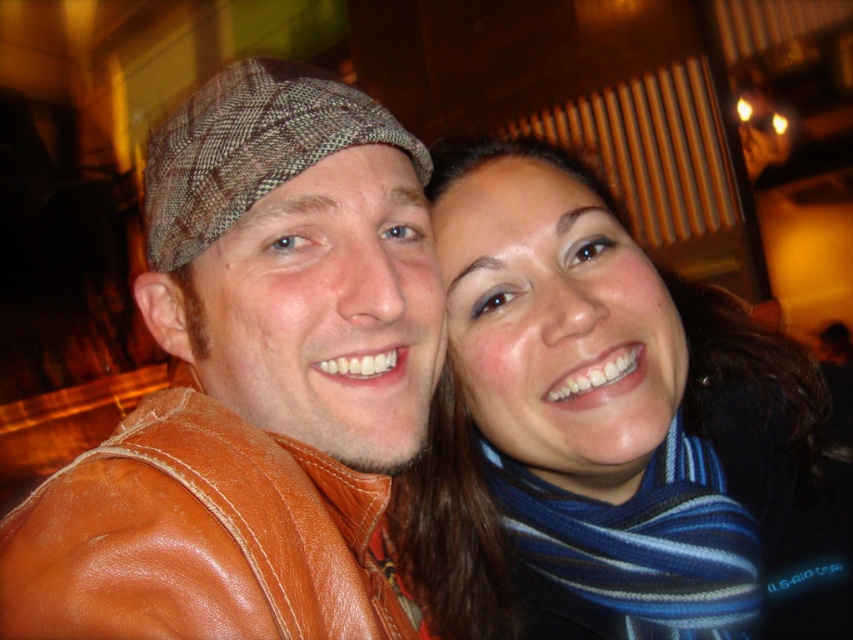
Which of these two, brown leather jacket at left or striped scarf at center, stands shorter?

Standing shorter between the two is brown leather jacket at left.

Who is higher up, brown leather jacket at left or striped scarf at center?

Positioned higher is brown leather jacket at left.

Between point (83, 609) and point (529, 324), which one is positioned in front?

Point (83, 609) is in front.

The width and height of the screenshot is (853, 640). I want to click on brown leather jacket at left, so click(x=253, y=381).

From the picture: Who is positioned more to the right, brown leather jacket at left or blue striped scarf at lower right?

blue striped scarf at lower right

Is point (245, 486) positioned in front of point (695, 547)?

Yes, point (245, 486) is in front of point (695, 547).

Between point (323, 163) and point (532, 528), which one is positioned behind?

Positioned behind is point (532, 528).

Find the location of a particular element. This screenshot has width=853, height=640. brown leather jacket at left is located at coordinates (253, 381).

Between blue striped scarf at lower right and brown plaid hat at upper left, which one is positioned lower?

blue striped scarf at lower right

Does blue striped scarf at lower right have a smaller size compared to brown plaid hat at upper left?

Correct, blue striped scarf at lower right occupies less space than brown plaid hat at upper left.

Measure the distance between blue striped scarf at lower right and camera.

The distance of blue striped scarf at lower right from camera is 33.38 inches.

Image resolution: width=853 pixels, height=640 pixels. In order to click on blue striped scarf at lower right in this screenshot , I will do `click(640, 545)`.